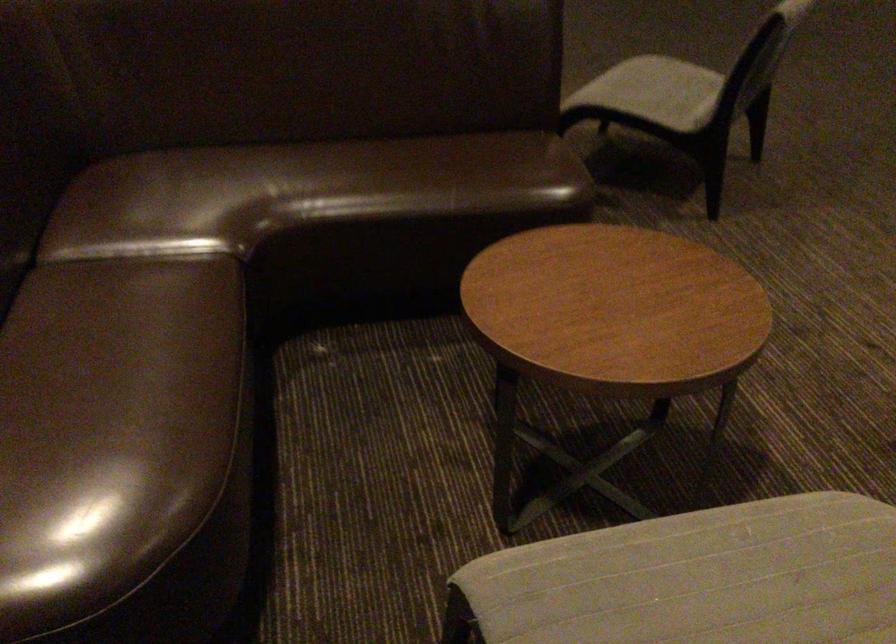
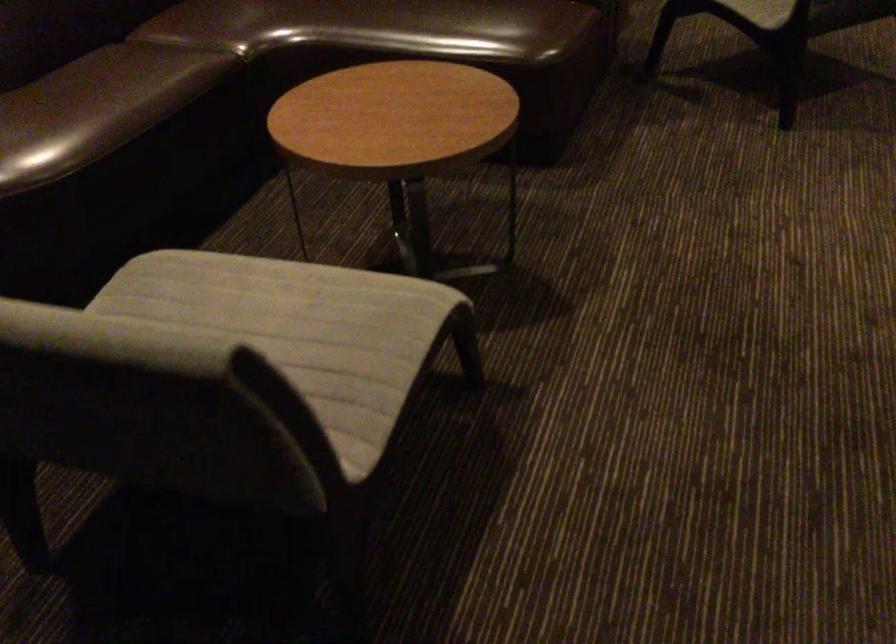
Find the pixel in the second image that matches pixel 145 453 in the first image.

(42, 138)